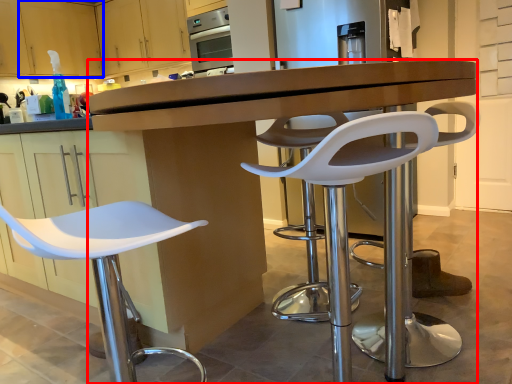
Question: Which object is further to the camera taking this photo, desk (highlighted by a red box) or cabinetry (highlighted by a blue box)?

Choices:
 (A) desk
 (B) cabinetry

Answer: (B)